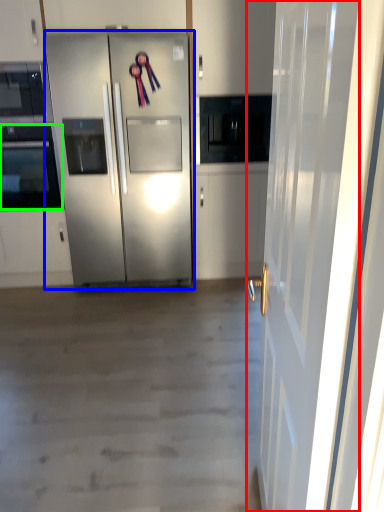
Question: Which is nearer to the door (highlighted by a red box)? refrigerator (highlighted by a blue box) or oven (highlighted by a green box).

Choices:
 (A) refrigerator
 (B) oven

Answer: (A)